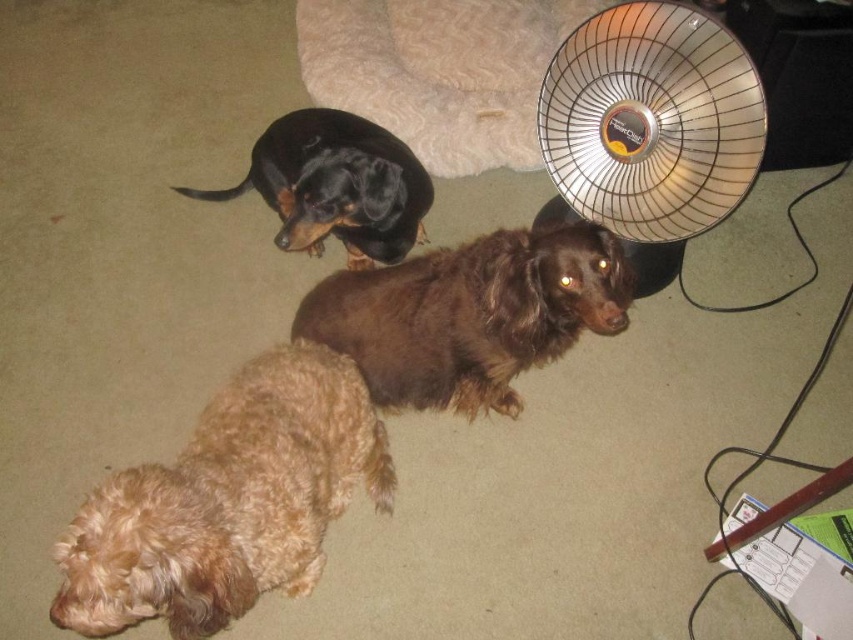
Is brown furry dog at center to the right of beige plush dog bed at upper center from the viewer's perspective?

Yes, brown furry dog at center is to the right of beige plush dog bed at upper center.

Describe the element at coordinates (469, 314) in the screenshot. The image size is (853, 640). I see `brown furry dog at center` at that location.

You are a GUI agent. You are given a task and a screenshot of the screen. Output one action in this format:
    pyautogui.click(x=<x>, y=<y>)
    Task: Click on the brown furry dog at center
    The height and width of the screenshot is (640, 853).
    Given the screenshot: What is the action you would take?
    pyautogui.click(x=469, y=314)

Which is more to the right, light brown fur at lower left or beige plush dog bed at upper center?

From the viewer's perspective, beige plush dog bed at upper center appears more on the right side.

Can you confirm if light brown fur at lower left is positioned above beige plush dog bed at upper center?

No, light brown fur at lower left is not above beige plush dog bed at upper center.

What do you see at coordinates (228, 500) in the screenshot? This screenshot has height=640, width=853. I see `light brown fur at lower left` at bounding box center [228, 500].

At what (x,y) coordinates should I click in order to perform the action: click on light brown fur at lower left. Please return your answer as a coordinate pair (x, y). Looking at the image, I should click on (228, 500).

Between point (128, 477) and point (567, 260), which one is positioned in front?

Point (128, 477) is in front.

Is light brown fur at lower left positioned in front of brown furry dog at center?

That is True.

Locate an element on the screen. Image resolution: width=853 pixels, height=640 pixels. light brown fur at lower left is located at coordinates (228, 500).